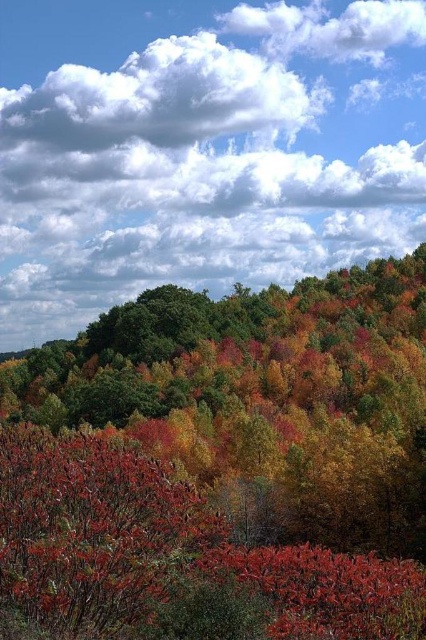
Question: Can you confirm if autumn foliage at center is positioned below white fluffy cloud at upper center?

Choices:
 (A) yes
 (B) no

Answer: (A)

Question: Which object is closer to the camera taking this photo?

Choices:
 (A) autumn foliage at center
 (B) white fluffy cloud at upper center

Answer: (A)

Question: Can you confirm if autumn foliage at center is positioned below white fluffy cloud at upper center?

Choices:
 (A) yes
 (B) no

Answer: (A)

Question: Can you confirm if autumn foliage at center is positioned below white fluffy cloud at upper center?

Choices:
 (A) no
 (B) yes

Answer: (B)